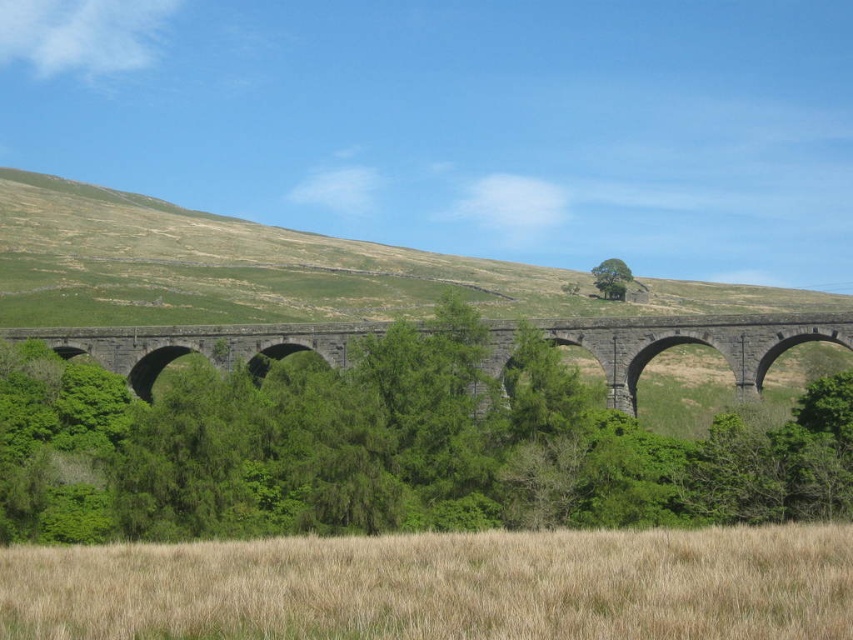
Question: Can you confirm if dry grass at lower center is bigger than green leafy tree at center?

Choices:
 (A) yes
 (B) no

Answer: (A)

Question: Which of the following is the closest to the observer?

Choices:
 (A) (608, 266)
 (B) (485, 272)

Answer: (A)

Question: Can you confirm if dry grass at lower center is positioned below green leafy tree at center?

Choices:
 (A) yes
 (B) no

Answer: (A)

Question: Which object is closer to the camera taking this photo?

Choices:
 (A) green leafy tree at center
 (B) dark gray stone bridge at center
 (C) dry grass at lower center

Answer: (C)

Question: Which of the following is the farthest from the observer?

Choices:
 (A) green leafy tree at center
 (B) dark gray stone bridge at center
 (C) dry grass at lower center
 (D) green grassy hillside at upper center

Answer: (A)

Question: Is dark gray stone bridge at center to the right of green leafy tree at center from the viewer's perspective?

Choices:
 (A) yes
 (B) no

Answer: (B)